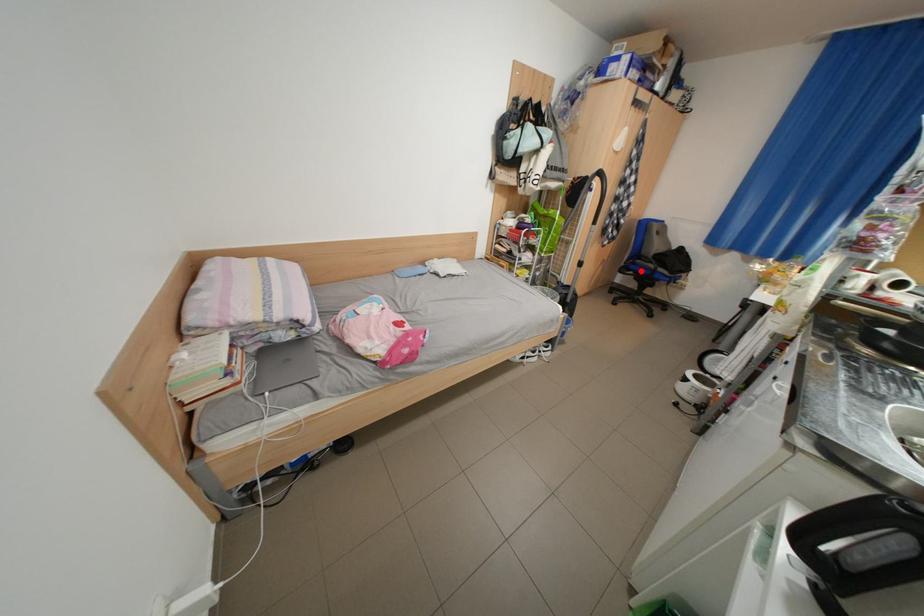
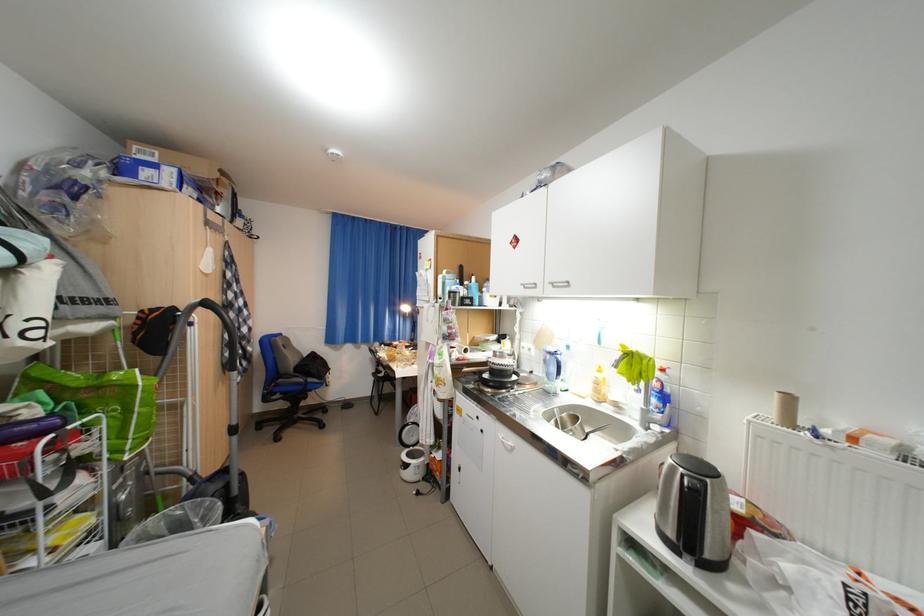
In the second image, find the point that corresponds to the highlighted location in the first image.

(286, 395)